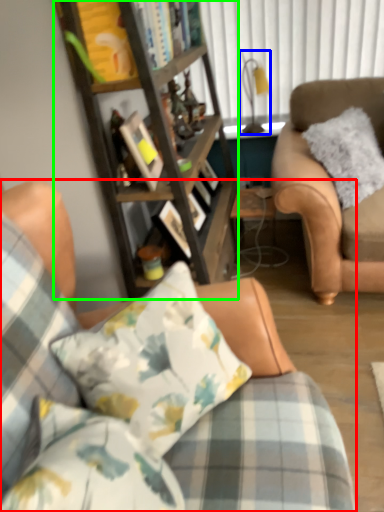
Question: Estimate the real-world distances between objects in this image. Which object is farther from studio couch (highlighted by a red box), lamp (highlighted by a blue box) or cabinetry (highlighted by a green box)?

Choices:
 (A) lamp
 (B) cabinetry

Answer: (A)